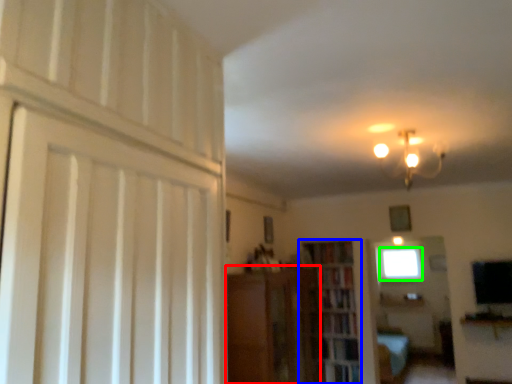
Question: Which object is the closest to the cabinetry (highlighted by a red box)? Choose among these: bookcase (highlighted by a blue box) or window (highlighted by a green box).

Choices:
 (A) bookcase
 (B) window

Answer: (A)